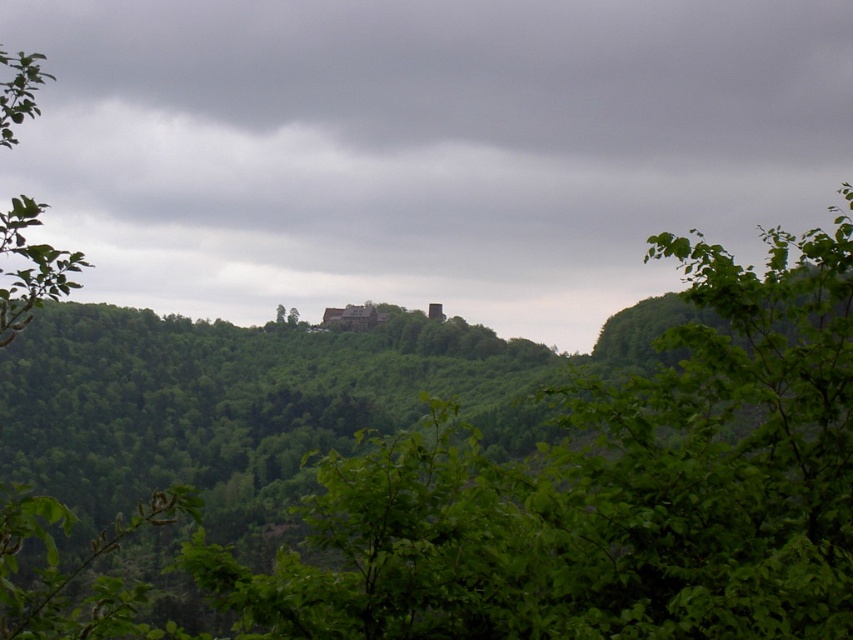
Does green leafy tree at center have a greater width compared to green leafy tree at left?

In fact, green leafy tree at center might be narrower than green leafy tree at left.

Can you confirm if green leafy tree at center is positioned below green leafy tree at left?

Yes.

Consider the image. Who is more forward, (x=177, y=504) or (x=73, y=253)?

Point (x=177, y=504) is more forward.

The width and height of the screenshot is (853, 640). What are the coordinates of `green leafy tree at center` in the screenshot? It's located at (606, 492).